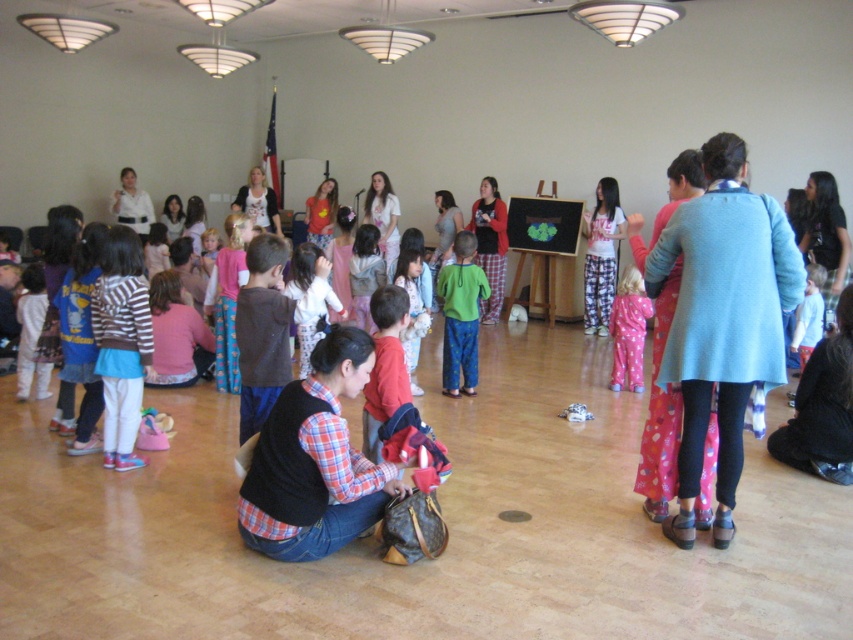
From the picture: You are a photographer at the event and want to capture a photo that includes both the plaid shirt at center and the green cotton shirt at center. Which shirt should you focus on first to ensure both are in the frame?

The plaid shirt at center is in front of the green cotton shirt at center, so focus on the plaid shirt at center first to ensure both are visible in the photo.

You are standing at the entrance of the room and see the point marked at coordinates (x=628, y=330). What object is located at that point?

The point at coordinates (x=628, y=330) is located on the pink pajama pants at center.